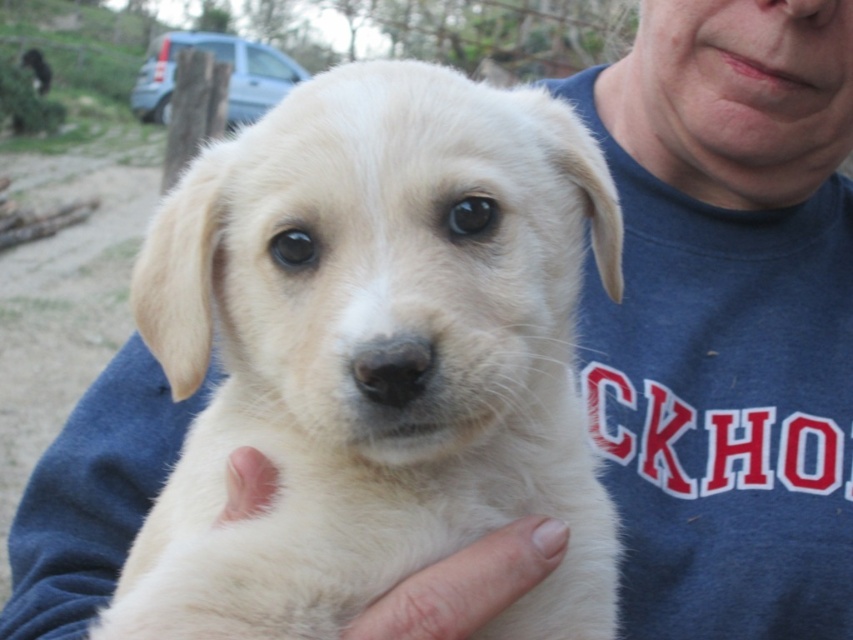
You are a photographer taking a picture of the white fur dog at center and the white soft fur at lower center. Which object should you focus on first if you want to capture both in the frame without moving the camera?

The white fur dog at center should be focused on first because it is positioned to the left of the white soft fur at lower center, so adjusting focus to the left ensures both are in the frame.

You are a photographer trying to capture a close shot of the white fur dog at center and the white soft fur at lower center. Which one should you focus on if you want to highlight the subject that is wider?

The white fur dog at center is wider than the white soft fur at lower center, so focus on the white fur dog at center to highlight the wider subject.

You are a veterinarian examining a dog and its fur. You notice the white fur dog at center and the white soft fur at lower center. Which one is taller?

The white fur dog at center is much taller than the white soft fur at lower center.